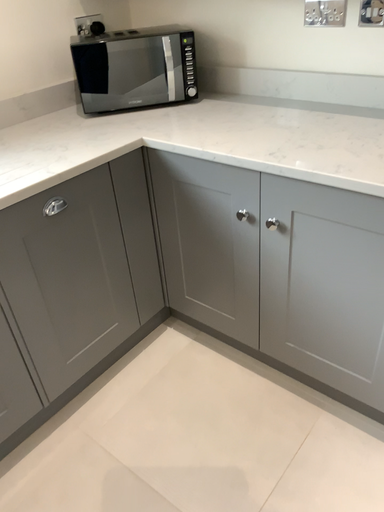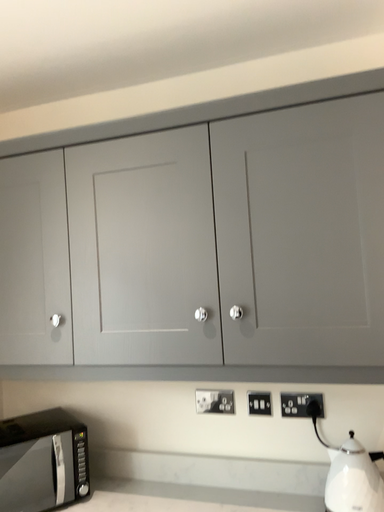
Question: Which way did the camera rotate in the video?

Choices:
 (A) rotated right
 (B) rotated left

Answer: (A)